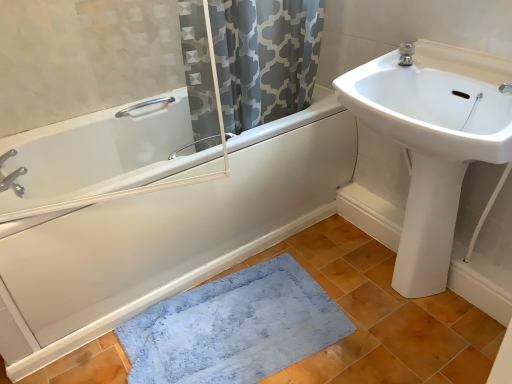
What are the coordinates of `free space to the right of satin nickel faucet at upper right, acting as the first tap starting from the top` in the screenshot? It's located at (446, 65).